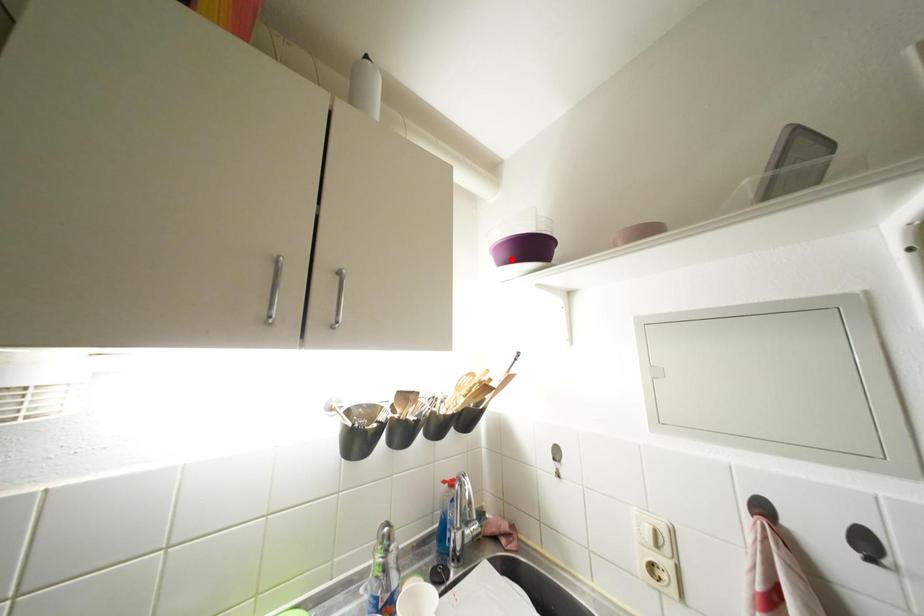
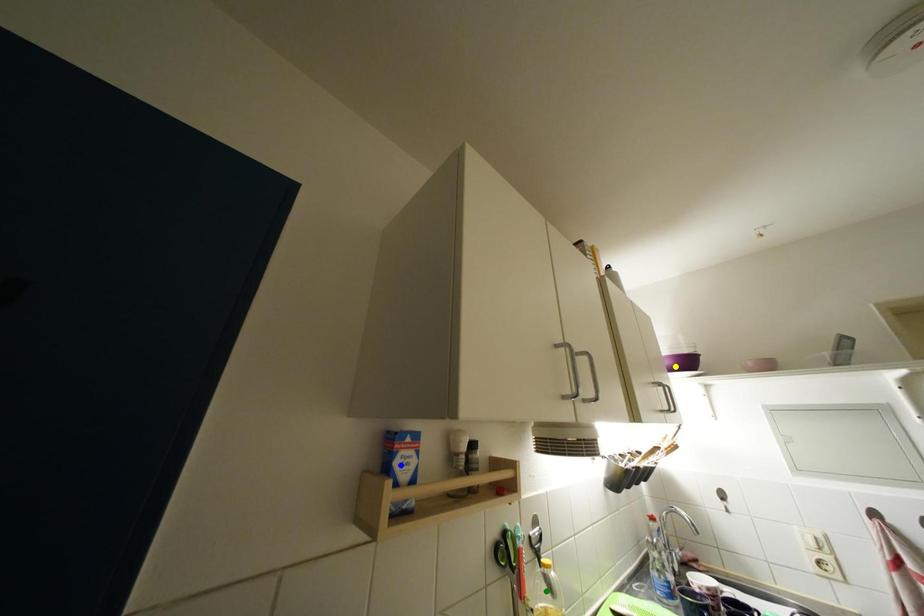
Question: I am providing you with two images of the same scene from different viewpoints. A red point is marked on the first image. You are given multiple points on the second image. Which spot in image 2 lines up with the point in image 1?

Choices:
 (A) yellow point
 (B) green point
 (C) blue point

Answer: (A)